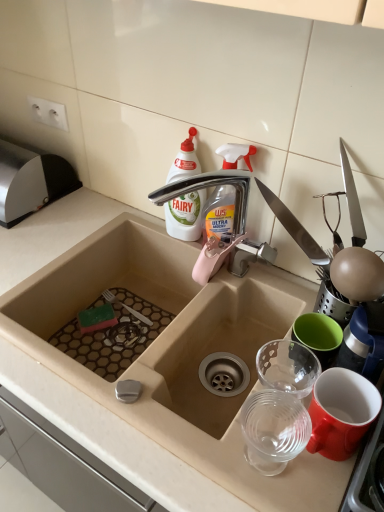
The width and height of the screenshot is (384, 512). In order to click on free area behind transparent plastic cups at right in this screenshot , I will do `click(256, 392)`.